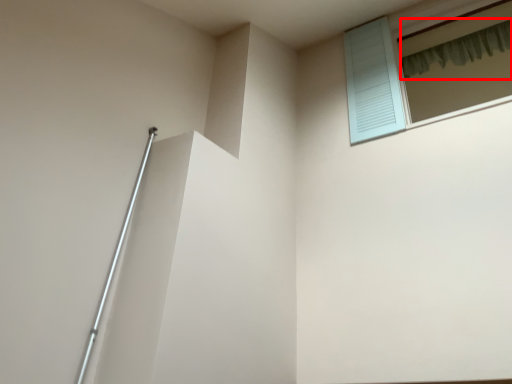
Question: Where is shower curtain (annotated by the red box) located in relation to window in the image?

Choices:
 (A) left
 (B) right

Answer: (B)